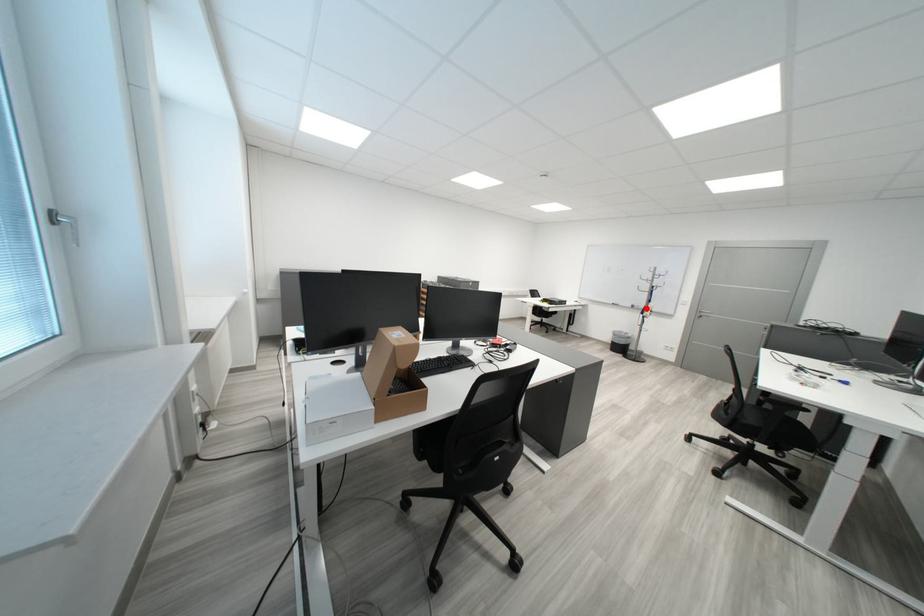
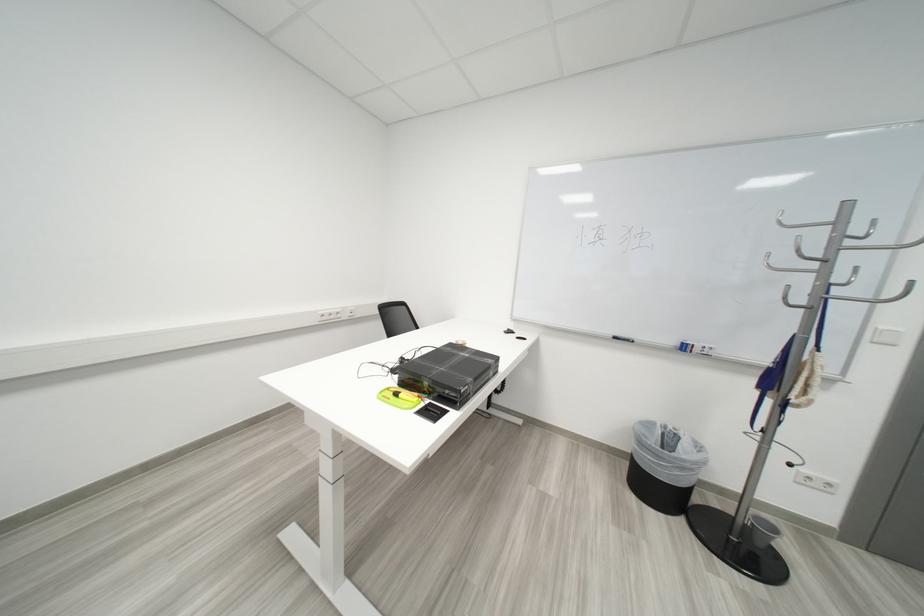
Locate, in the second image, the point that corresponds to the highlighted location in the first image.

(698, 350)